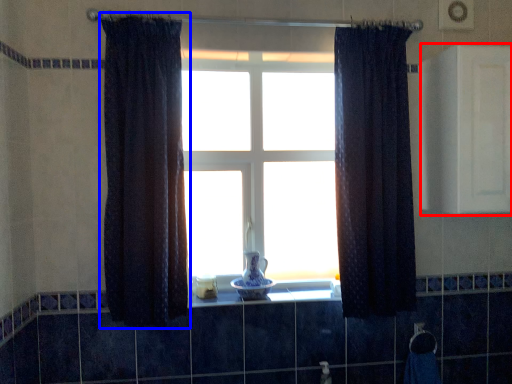
Question: Which object is further to the camera taking this photo, medicine cabinet (highlighted by a red box) or curtain (highlighted by a blue box)?

Choices:
 (A) medicine cabinet
 (B) curtain

Answer: (A)